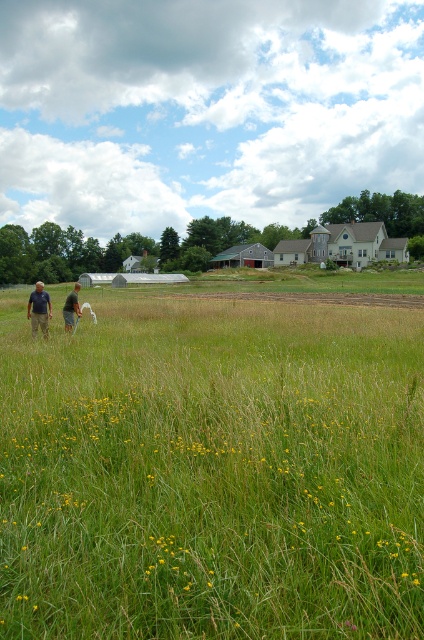
You are standing in the field and see the point at coordinates (x=39, y=308). What object is located there?

The point at coordinates (x=39, y=308) has matte black shirts at lower left.

You are a hiker who wants to cross the green grassy field at lower left. You notice the light brown fabric shirt at center nearby. Based on the height of the grass compared to the shirt, will the grass obscure your view while walking?

The green grassy field at lower left is taller than the light brown fabric shirt at center, so the grass will likely obscure your view while walking through it.